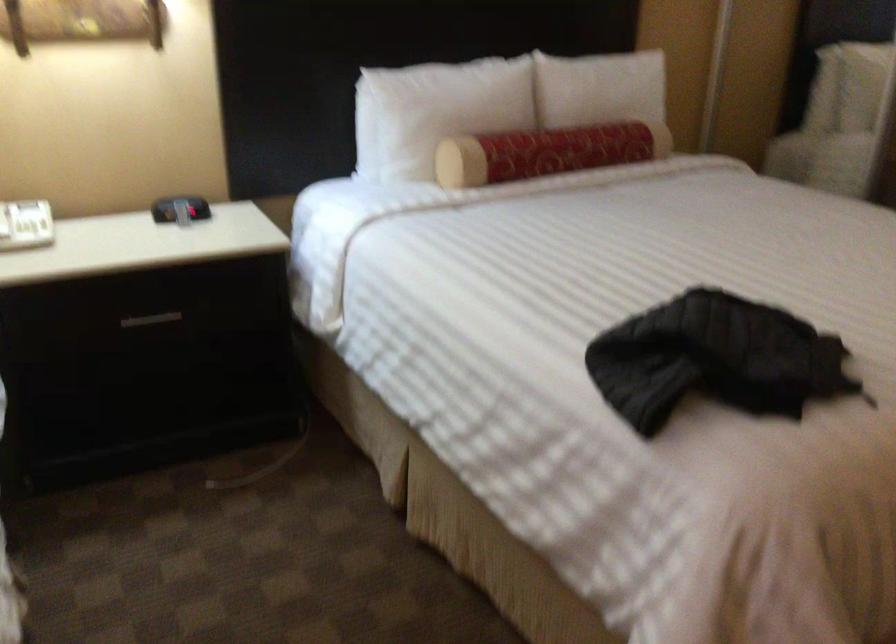
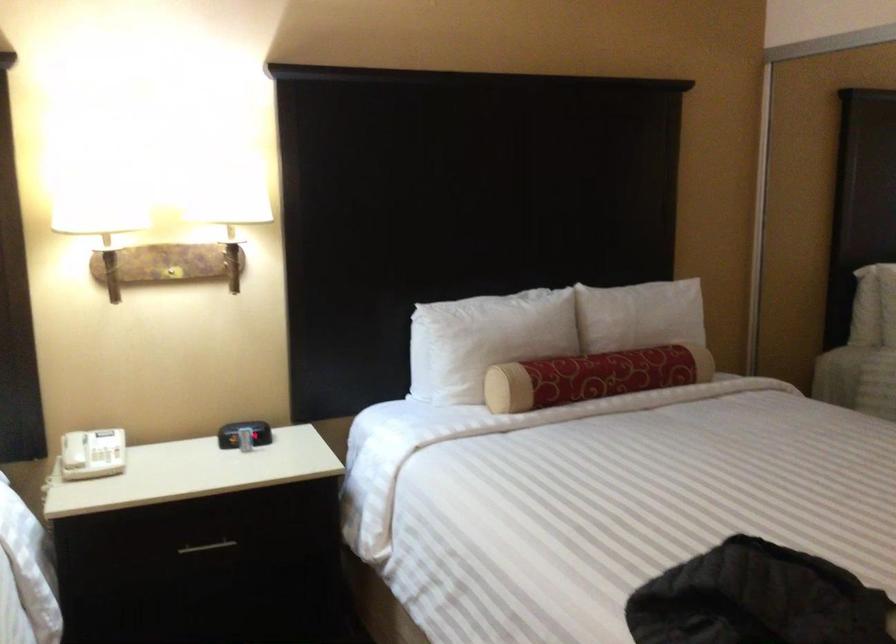
Locate, in the second image, the point that corresponds to (x=552, y=151) in the first image.

(592, 377)